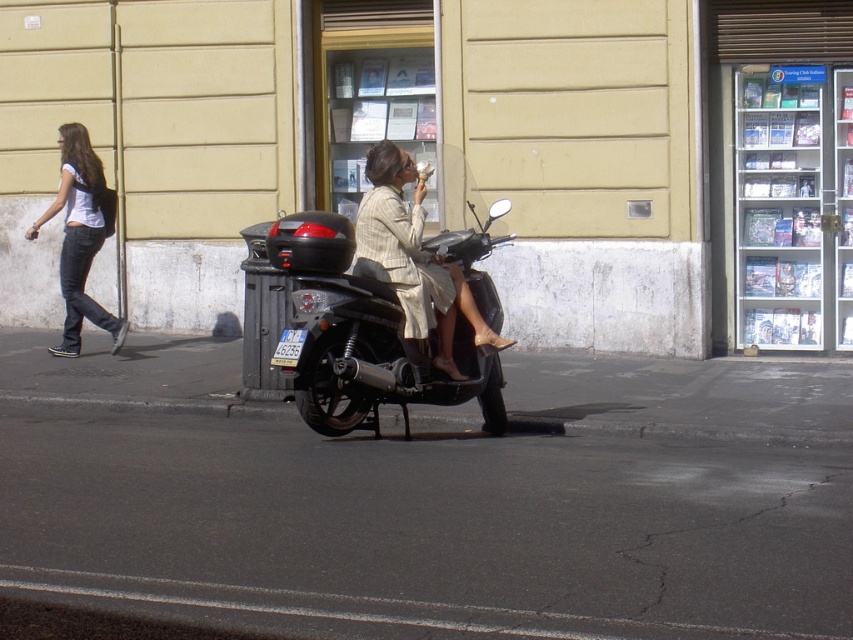
Question: Considering the real-world distances, which object is farthest from the matte beige dress at center?

Choices:
 (A) shiny black scooter at center
 (B) denim jeans at left

Answer: (B)

Question: From the image, what is the correct spatial relationship of shiny black scooter at center in relation to denim jeans at left?

Choices:
 (A) left
 (B) right

Answer: (B)

Question: Which point is closer to the camera?

Choices:
 (A) (415, 252)
 (B) (57, 208)

Answer: (A)

Question: Which of the following is the closest to the observer?

Choices:
 (A) shiny black scooter at center
 (B) denim jeans at left
 (C) matte beige dress at center

Answer: (A)

Question: Can you confirm if matte beige dress at center is bigger than denim jeans at left?

Choices:
 (A) no
 (B) yes

Answer: (A)

Question: Does shiny black scooter at center appear on the right side of matte beige dress at center?

Choices:
 (A) yes
 (B) no

Answer: (B)